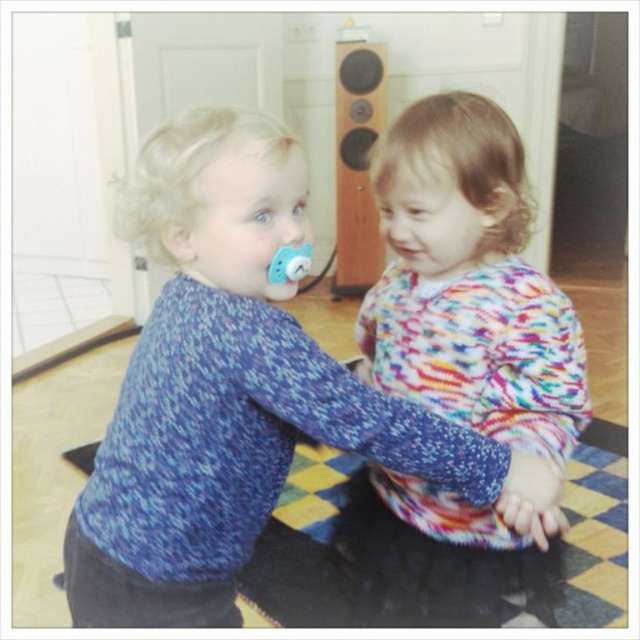
Question: Does blue knitted sweater at center have a greater width compared to wooden speaker at upper center?

Choices:
 (A) no
 (B) yes

Answer: (B)

Question: Which object is the closest to the wooden speaker at upper center?

Choices:
 (A) pink matte lips at center
 (B) blue knitted sweater at center

Answer: (A)

Question: Is blue knitted sweater at center closer to camera compared to matte blue pacifier at left?

Choices:
 (A) no
 (B) yes

Answer: (B)

Question: Is multicolored knit sweater at center wider than matte blue pacifier at left?

Choices:
 (A) yes
 (B) no

Answer: (A)

Question: Estimate the real-world distances between objects in this image. Which object is closer to the blue knitted sweater at center?

Choices:
 (A) wooden speaker at upper center
 (B) multicolored knit sweater at center

Answer: (B)

Question: Which point is farther to the camera?

Choices:
 (A) (296, 385)
 (B) (310, 250)
 (C) (364, 333)
 (D) (413, 252)

Answer: (C)